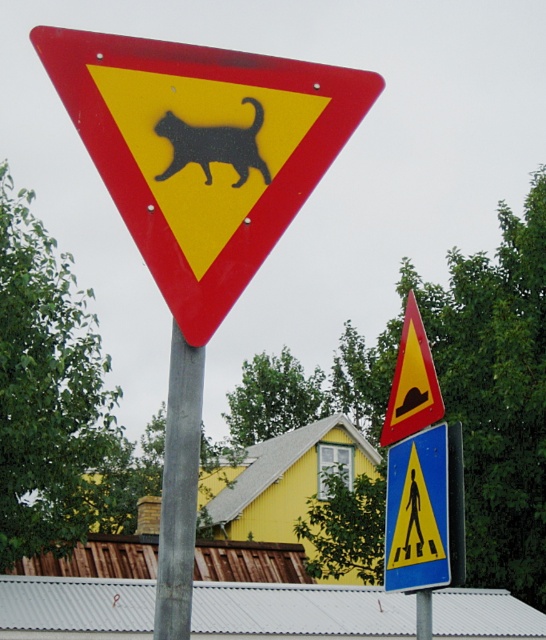
Is metallic red triangle at upper center positioned behind metallic yellow hazard at center?

That is False.

Between point (201, 289) and point (426, 396), which one is positioned in front?

Point (201, 289) is more forward.

Between point (218, 64) and point (389, 442), which one is positioned behind?

The point (389, 442) is more distant.

This screenshot has width=546, height=640. I want to click on metallic red triangle at upper center, so click(203, 150).

Is point (181, 372) less distant than point (402, 488)?

Yes, point (181, 372) is closer to viewer.

Which of these two, metallic pole at center or yellow plastic pedestrian crossing sign at upper center, stands taller?

metallic pole at center is taller.

Which is behind, point (192, 426) or point (430, 579)?

Point (430, 579)

This screenshot has width=546, height=640. Find the location of `metallic pole at center`. metallic pole at center is located at coordinates (179, 490).

Who is positioned more to the right, metallic red triangle at upper center or yellow plastic pedestrian crossing sign at upper center?

From the viewer's perspective, yellow plastic pedestrian crossing sign at upper center appears more on the right side.

Does metallic red triangle at upper center have a greater width compared to yellow plastic pedestrian crossing sign at upper center?

Correct, the width of metallic red triangle at upper center exceeds that of yellow plastic pedestrian crossing sign at upper center.

Who is more forward, (349, 134) or (444, 433)?

Point (349, 134) is in front.

What are the coordinates of `metallic red triangle at upper center` in the screenshot? It's located at (203, 150).